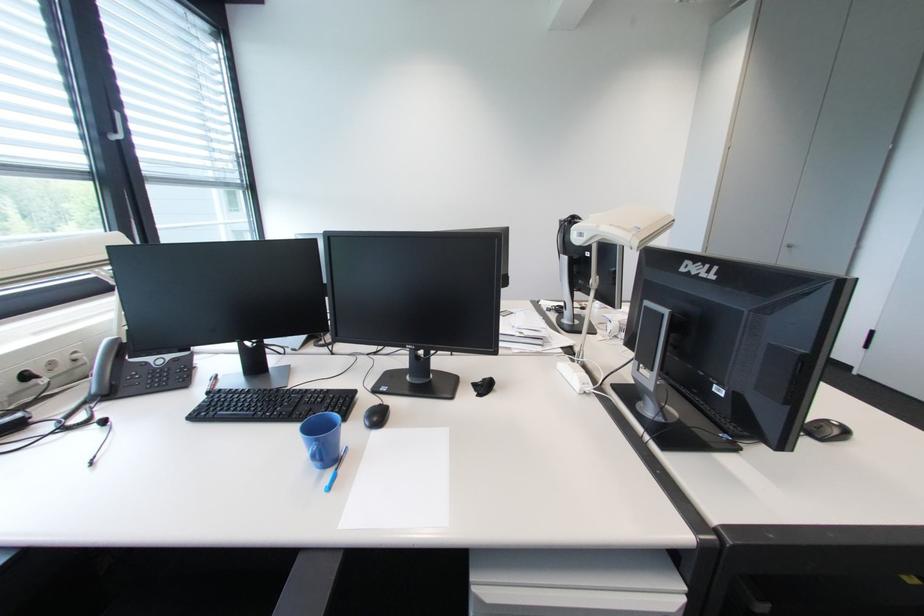
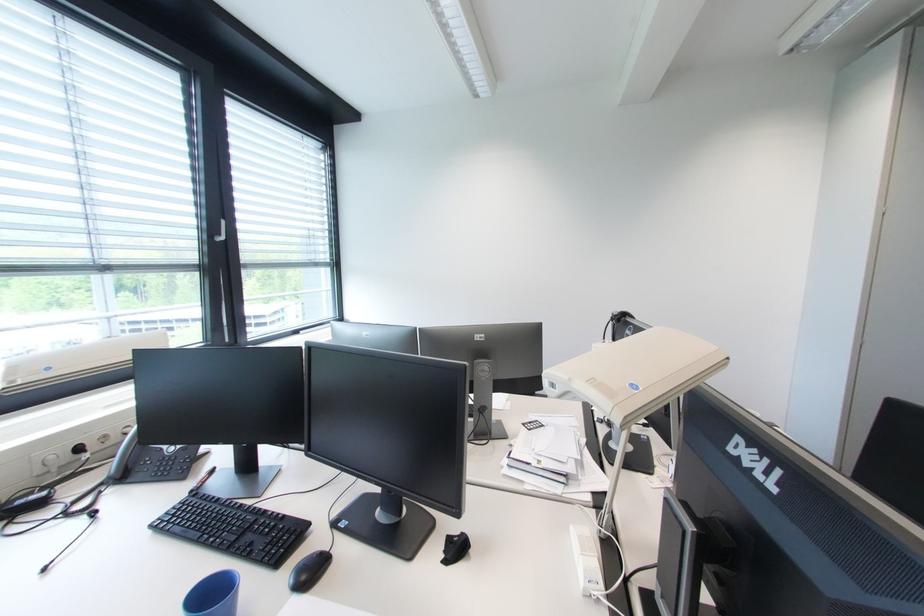
Find the pixel in the second image that matches (604,227) in the first image.

(577, 381)